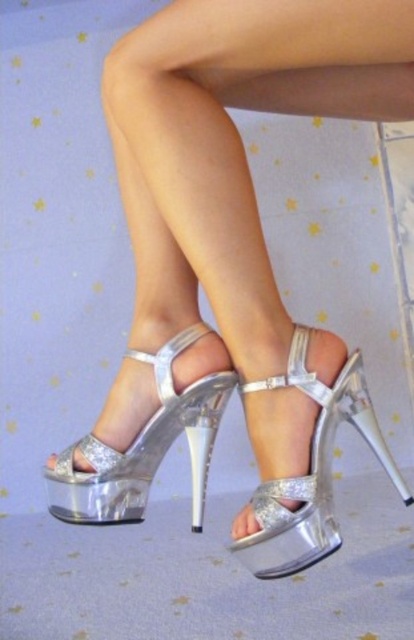
Question: Does shiny silver sandal at center have a smaller size compared to shiny metallic platform sandal at center?

Choices:
 (A) no
 (B) yes

Answer: (A)

Question: Can you confirm if shiny silver sandal at center is thinner than shiny metallic platform sandal at center?

Choices:
 (A) yes
 (B) no

Answer: (B)

Question: Which object appears closest to the camera in this image?

Choices:
 (A) shiny silver sandal at center
 (B) shiny metallic platform sandal at center

Answer: (B)

Question: Among these points, which one is farthest from the camera?

Choices:
 (A) (98, 504)
 (B) (399, 472)

Answer: (B)

Question: Can you confirm if shiny silver sandal at center is bigger than shiny metallic platform sandal at center?

Choices:
 (A) yes
 (B) no

Answer: (A)

Question: Which object appears farthest from the camera in this image?

Choices:
 (A) shiny metallic platform sandal at center
 (B) shiny silver sandal at center

Answer: (B)